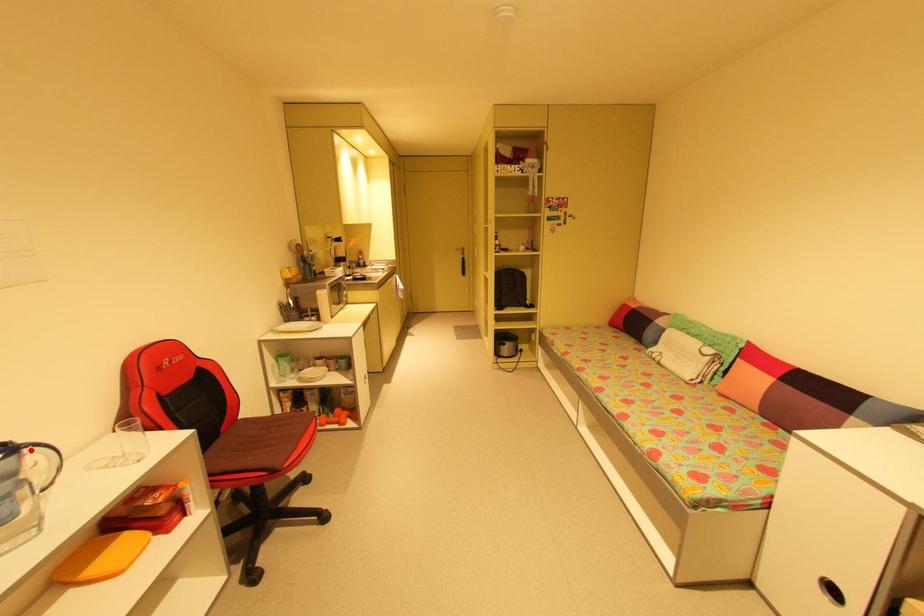
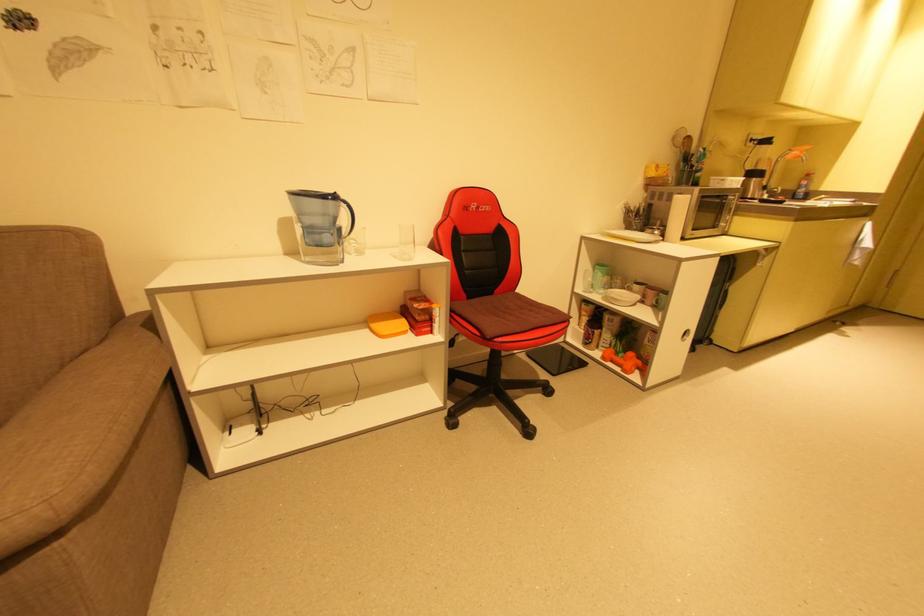
In the second image, find the point that corresponds to the highlighted location in the first image.

(346, 204)